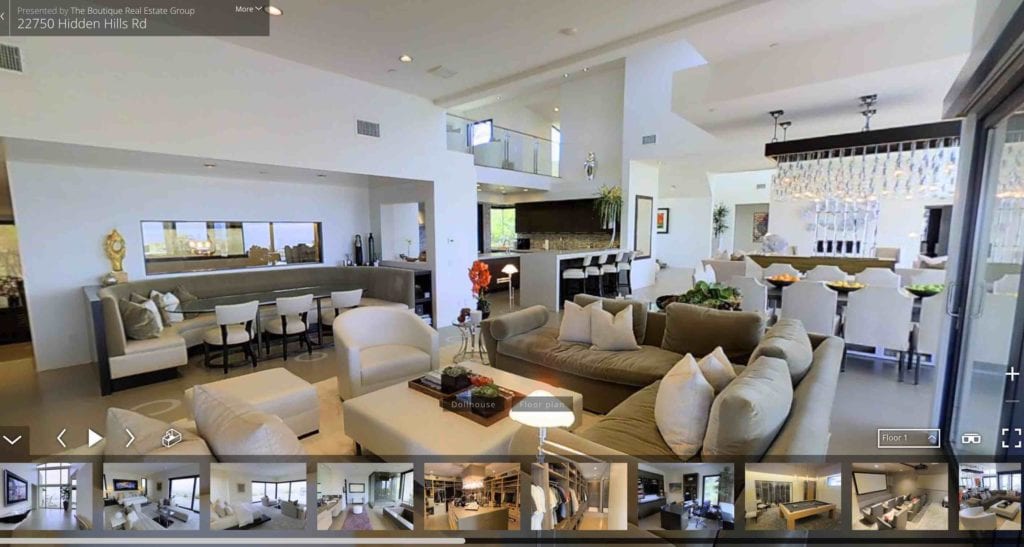
The width and height of the screenshot is (1024, 547). I want to click on couch, so click(x=635, y=366).